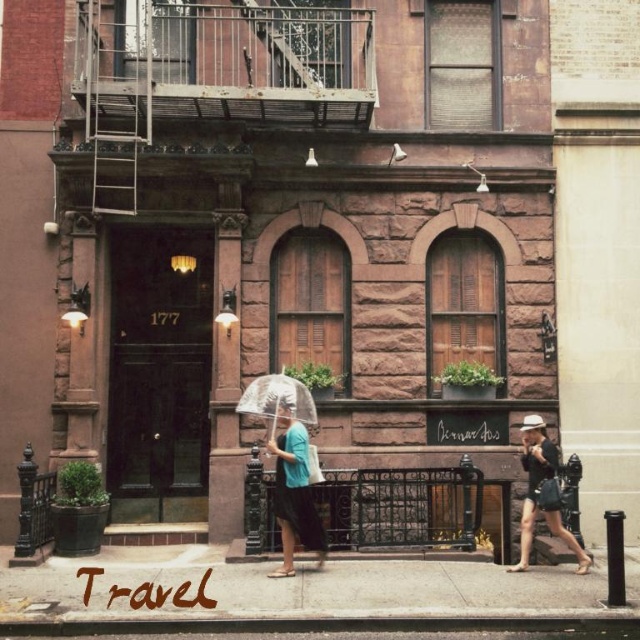
You are standing in front of the brownstone building and want to determine the relative positions of two points marked on the building facade. Which point, point (228, 605) or point (268, 438), is closer to you?

Point (228, 605) is closer to the viewer than point (268, 438).

You are standing in front of the brownstone building and want to take a photo. There are two points marked on the building facade at coordinates point (420,579) and point (556,493). Which point should you focus on first if you want to capture the closest part of the building in your photo?

Point (420,579) is closer to the camera than point (556,493), so you should focus on point (420,579) first to capture the closest part of the building.

From the picture: You are a delivery person with a large box that is 1 meter wide. You need to walk along the path to deliver the package to the entrance of the brownstone building. Can the smooth concrete pavement at center accommodate your box without hitting the matte black dress at lower right?

The smooth concrete pavement at center is wider than the matte black dress at lower right. Since the pavement is wider, the 1 meter wide box can fit on the smooth concrete pavement at center without hitting the dress.